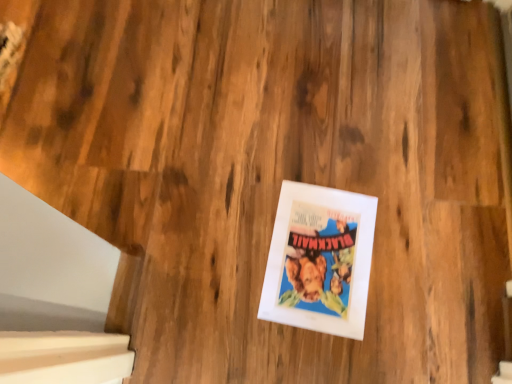
Find the location of a particular element. The image size is (512, 384). blank area beneath white matte picture frame at center (from a real-world perspective) is located at coordinates (315, 252).